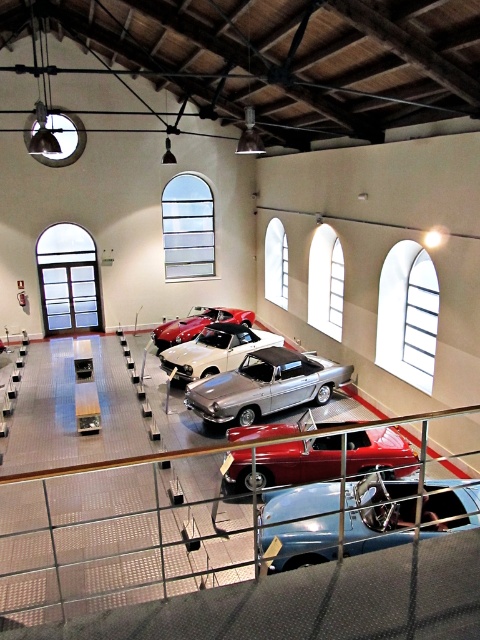
Question: Does shiny blue convertible at center have a smaller size compared to white metallic car at center?

Choices:
 (A) yes
 (B) no

Answer: (A)

Question: Does glossy metallic car at center have a greater width compared to white metallic car at center?

Choices:
 (A) no
 (B) yes

Answer: (B)

Question: Which object appears farthest from the camera in this image?

Choices:
 (A) silver metallic car at center
 (B) white metallic car at center

Answer: (B)

Question: Which object is the farthest from the shiny blue convertible at center?

Choices:
 (A) glossy metallic car at center
 (B) shiny red convertible at center
 (C) silver metallic car at center

Answer: (B)

Question: Based on their relative distances, which object is nearer to the shiny red convertible at center?

Choices:
 (A) shiny blue convertible at center
 (B) silver metallic car at center
 (C) glossy metallic car at center
 (D) white metallic car at center

Answer: (D)

Question: Does shiny blue convertible at center appear on the left side of silver metallic car at center?

Choices:
 (A) no
 (B) yes

Answer: (A)